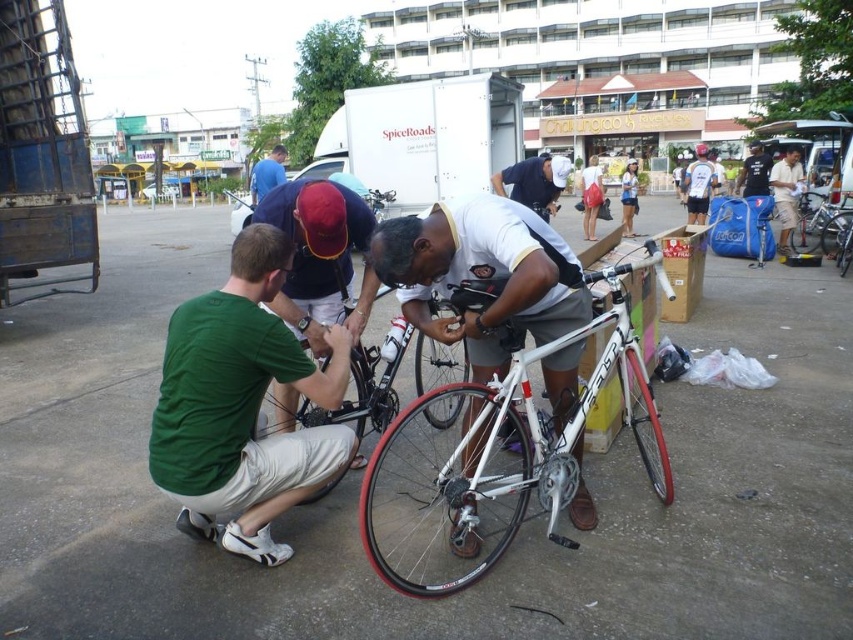
Question: Which point is closer to the camera taking this photo?

Choices:
 (A) (299, 477)
 (B) (378, 205)
 (C) (460, 588)

Answer: (C)

Question: Considering the relative positions of green fabric shirt at left and light brown shorts at center in the image provided, where is green fabric shirt at left located with respect to light brown shorts at center?

Choices:
 (A) below
 (B) above

Answer: (A)

Question: Which point is closer to the camera taking this photo?

Choices:
 (A) (367, 520)
 (B) (315, 348)
 (C) (265, 189)

Answer: (A)

Question: Is light brown shorts at center bigger than white matte bicycle at center?

Choices:
 (A) yes
 (B) no

Answer: (A)

Question: Is green fabric shirt at left below white matte shirt at center?

Choices:
 (A) yes
 (B) no

Answer: (A)

Question: Based on their relative distances, which object is farther from the light brown shorts at center?

Choices:
 (A) dark blue shirt at center
 (B) white cotton shirt at center
 (C) blue fabric shirt at upper center

Answer: (C)